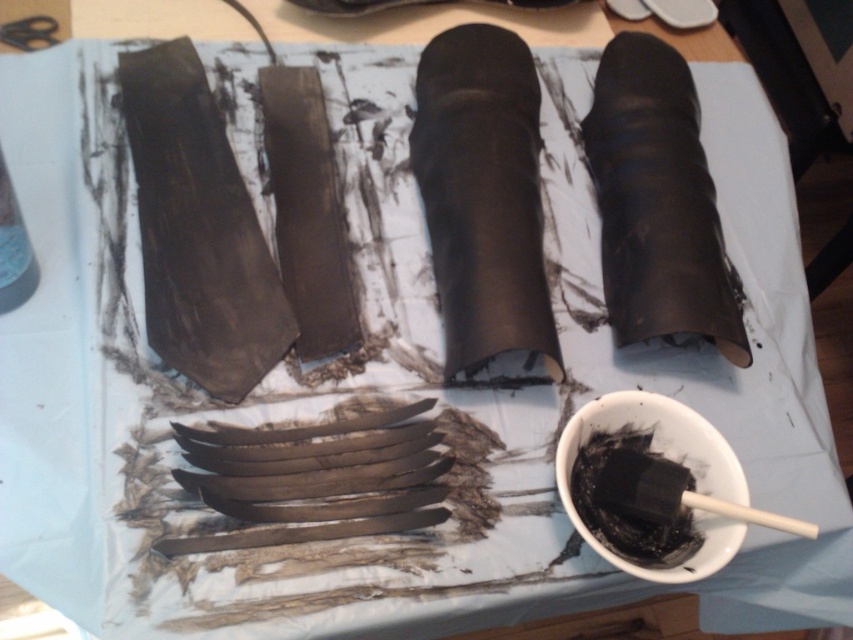
Question: Which object appears farthest from the camera in this image?

Choices:
 (A) black matte bowl at lower right
 (B) matte black boot at center
 (C) matte black boot at right

Answer: (C)

Question: Which point is farther from the camera taking this photo?

Choices:
 (A) (686, 573)
 (B) (647, 108)
 (C) (438, 291)

Answer: (B)

Question: Is matte black boot at center to the left of black matte bowl at lower right from the viewer's perspective?

Choices:
 (A) yes
 (B) no

Answer: (A)

Question: Is matte black boot at center smaller than black matte bowl at lower right?

Choices:
 (A) no
 (B) yes

Answer: (A)

Question: Which of the following is the closest to the observer?

Choices:
 (A) matte black boot at center
 (B) matte black boot at right

Answer: (A)

Question: Considering the relative positions of matte black boot at center and black matte bowl at lower right in the image provided, where is matte black boot at center located with respect to black matte bowl at lower right?

Choices:
 (A) above
 (B) below

Answer: (A)